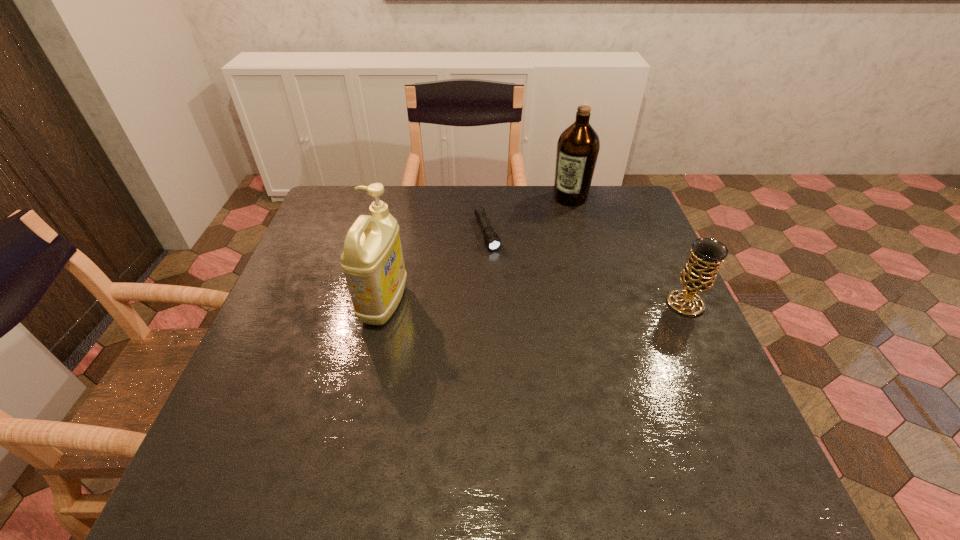
Locate an element on the screen. This screenshot has height=540, width=960. vacant space located at the lens end of the second farthest object is located at coordinates (517, 314).

The width and height of the screenshot is (960, 540). I want to click on vacant position located at the lens end of the second farthest object, so click(x=525, y=332).

Locate an element on the screen. The height and width of the screenshot is (540, 960). vacant point located 0.080m on the label of the olive oil is located at coordinates (554, 220).

Identify the location of vacant space situated on the label of the olive oil. The width and height of the screenshot is (960, 540). (549, 226).

The width and height of the screenshot is (960, 540). In order to click on vacant space located on the label of the olive oil in this screenshot , I will do `click(553, 221)`.

Locate an element on the screen. flashlight present at the far edge is located at coordinates (492, 240).

Locate an element on the screen. olive oil situated at the far edge is located at coordinates (578, 146).

The height and width of the screenshot is (540, 960). I want to click on chalice that is at the right edge, so click(699, 273).

Where is `olive oil present at the right edge`? This screenshot has width=960, height=540. olive oil present at the right edge is located at coordinates (578, 146).

Locate an element on the screen. The width and height of the screenshot is (960, 540). object present at the far right corner is located at coordinates (578, 146).